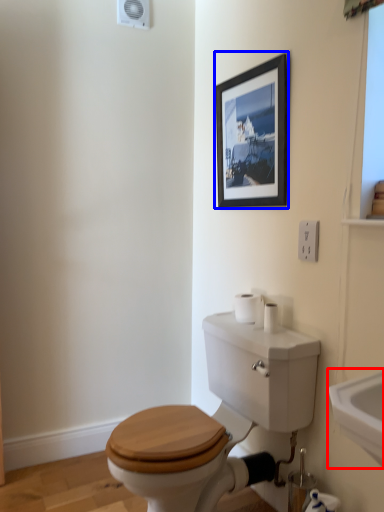
Question: Among these objects, which one is nearest to the camera, sink (highlighted by a red box) or picture frame (highlighted by a blue box)?

Choices:
 (A) sink
 (B) picture frame

Answer: (A)